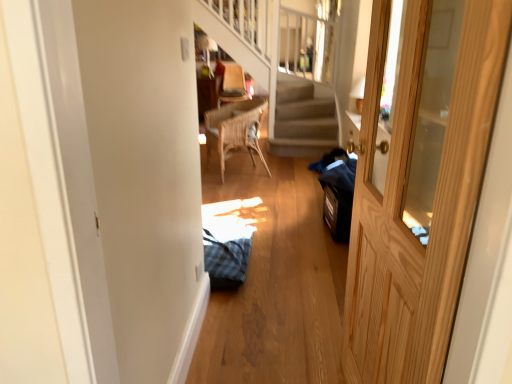
Locate an element on the screen. This screenshot has height=384, width=512. wooden door at right is located at coordinates (420, 188).

Measure the distance between point (x=433, y=244) and camera.

The depth of point (x=433, y=244) is 36.81 inches.

Where is `wooden woven armchair at upper center`? wooden woven armchair at upper center is located at coordinates (230, 82).

The image size is (512, 384). I want to click on woven wood chair at center, so click(x=234, y=130).

Based on the photo, considering the relative sizes of wooden woven armchair at upper center and woven wood chair at center in the image provided, is wooden woven armchair at upper center thinner than woven wood chair at center?

No.

From the image's perspective, which one is positioned lower, wooden woven armchair at upper center or woven wood chair at center?

woven wood chair at center is shown below in the image.

Is wooden woven armchair at upper center located outside woven wood chair at center?

Yes.

Based on the photo, which object is closer to the camera, wooden woven armchair at upper center or woven wood chair at center?

woven wood chair at center is closer to the camera.

You are a GUI agent. You are given a task and a screenshot of the screen. Output one action in this format:
    pyautogui.click(x=<x>, y=<y>)
    Task: Click on the chair that is on the left side of wooden door at right
    
    Given the screenshot: What is the action you would take?
    pyautogui.click(x=234, y=130)

From the picture: From the image's perspective, is woven wood chair at center below wooden door at right?

No, from the image's perspective, woven wood chair at center is not beneath wooden door at right.

In the scene shown: Is wooden door at right completely or partially inside woven wood chair at center?

No, wooden door at right is not a part of woven wood chair at center.

Is wooden woven armchair at upper center turned away from wooden door at right?

No.

How far apart are wooden woven armchair at upper center and wooden door at right?

wooden woven armchair at upper center is 12.36 feet away from wooden door at right.

Considering the points (243, 86) and (485, 116), which point is in front, point (243, 86) or point (485, 116)?

The point (485, 116) is in front.

How many degrees apart are the facing directions of wooden woven armchair at upper center and wooden door at right?

The angular difference between wooden woven armchair at upper center and wooden door at right is 94.9 degrees.

Is wooden door at right outside of woven wood chair at center?

wooden door at right lies outside woven wood chair at center's area.

From the image's perspective, which one is positioned higher, wooden door at right or woven wood chair at center?

From the image's view, woven wood chair at center is above.

In the scene shown: Considering the positions of objects wooden door at right and woven wood chair at center in the image provided, who is in front, wooden door at right or woven wood chair at center?

Positioned in front is wooden door at right.

From a real-world perspective, which is physically below, woven wood chair at center or wooden woven armchair at upper center?

woven wood chair at center, from a real-world perspective.

Is woven wood chair at center looking in the opposite direction of wooden woven armchair at upper center?

No.

Measure the distance from woven wood chair at center to wooden woven armchair at upper center.

They are 23.09 inches apart.

Looking at this image, from a real-world perspective, is wooden door at right over wooden woven armchair at upper center?

Yes.

The height and width of the screenshot is (384, 512). Identify the location of door that is above the wooden woven armchair at upper center (from a real-world perspective). (420, 188).

Is wooden door at right positioned far away from wooden woven armchair at upper center?

Yes, wooden door at right and wooden woven armchair at upper center are quite far apart.

Which is correct: wooden door at right is inside wooden woven armchair at upper center, or outside of it?

wooden door at right lies outside wooden woven armchair at upper center.

You are a GUI agent. You are given a task and a screenshot of the screen. Output one action in this format:
    pyautogui.click(x=<x>, y=<y>)
    Task: Click on the armchair behind the woven wood chair at center
    This screenshot has width=512, height=384.
    Given the screenshot: What is the action you would take?
    pyautogui.click(x=230, y=82)

In order to click on chair below the wooden door at right (from a real-world perspective) in this screenshot , I will do `click(234, 130)`.

Based on their spatial positions, is woven wood chair at center or wooden woven armchair at upper center closer to wooden door at right?

The object closer to wooden door at right is woven wood chair at center.

Considering their positions, is wooden door at right positioned closer to wooden woven armchair at upper center than woven wood chair at center?

woven wood chair at center lies closer to wooden woven armchair at upper center than the other object.

Based on their spatial positions, is wooden woven armchair at upper center or woven wood chair at center closer to wooden door at right?

The object closer to wooden door at right is woven wood chair at center.

Estimate the real-world distances between objects in this image. Which object is further from woven wood chair at center, wooden door at right or wooden woven armchair at upper center?

wooden door at right is further to woven wood chair at center.

Based on their spatial positions, is woven wood chair at center or wooden door at right further from wooden woven armchair at upper center?

wooden door at right.

Estimate the real-world distances between objects in this image. Which object is further from woven wood chair at center, wooden woven armchair at upper center or wooden door at right?

Among the two, wooden door at right is located further to woven wood chair at center.

Image resolution: width=512 pixels, height=384 pixels. What are the coordinates of `chair located between wooden door at right and wooden woven armchair at upper center in the depth direction` in the screenshot? It's located at (234, 130).